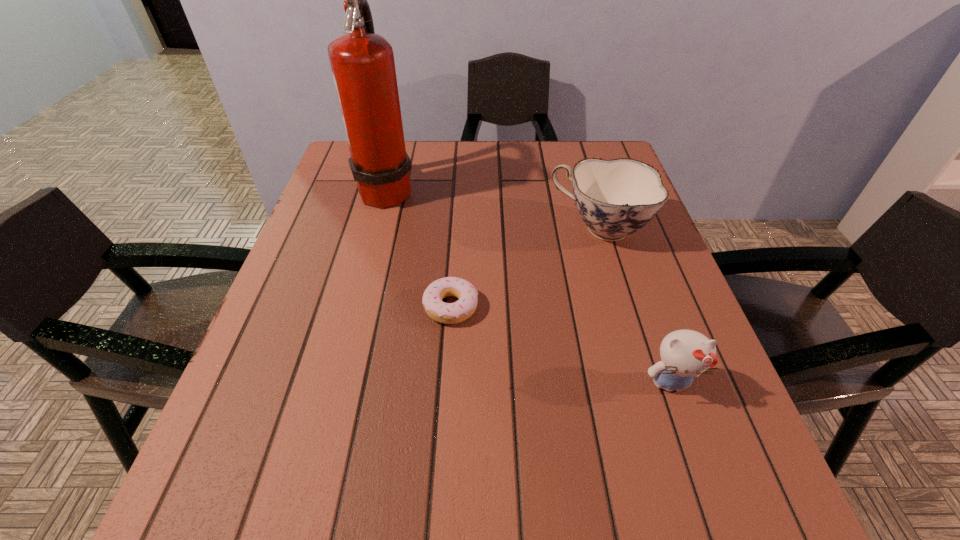
In order to click on object that is at the far edge in this screenshot , I will do `click(362, 62)`.

Find the location of a particular element. object that is at the left edge is located at coordinates (362, 62).

This screenshot has height=540, width=960. I want to click on chinaware at the right edge, so click(x=615, y=198).

Locate an element on the screen. The width and height of the screenshot is (960, 540). kitten that is at the right edge is located at coordinates (685, 354).

Identify the location of object at the far left corner. The height and width of the screenshot is (540, 960). (362, 62).

You are a GUI agent. You are given a task and a screenshot of the screen. Output one action in this format:
    pyautogui.click(x=<x>, y=<y>)
    Task: Click on the vacant space at the far edge
    The height and width of the screenshot is (540, 960).
    Given the screenshot: What is the action you would take?
    pyautogui.click(x=500, y=158)

Image resolution: width=960 pixels, height=540 pixels. I want to click on vacant space at the near edge, so click(300, 512).

Identify the location of vacant area at the left edge. (248, 364).

The width and height of the screenshot is (960, 540). In the image, there is a desktop. In order to click on vacant space at the right edge in this screenshot , I will do `click(640, 387)`.

Image resolution: width=960 pixels, height=540 pixels. Identify the location of vacant area at the far right corner of the desktop. (588, 141).